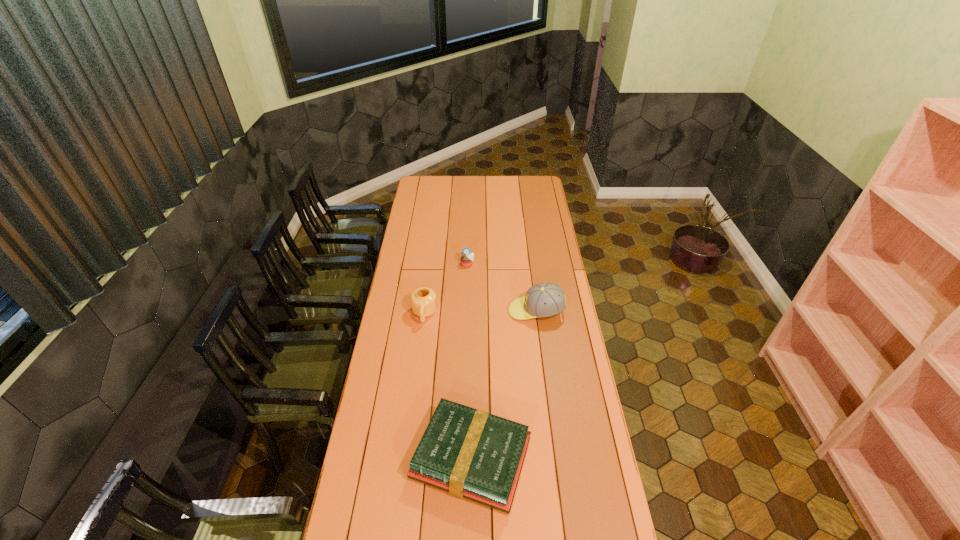
Locate an element on the screen. baseball cap is located at coordinates (542, 300).

The image size is (960, 540). Find the location of `mug`. mug is located at coordinates (423, 300).

This screenshot has width=960, height=540. In order to click on the farthest object in this screenshot , I will do `click(467, 258)`.

Locate an element on the screen. The height and width of the screenshot is (540, 960). hardback book is located at coordinates (469, 453).

In order to click on vacant area located on the front-facing side of the tallest object in this screenshot , I will do `click(449, 311)`.

Find the location of a particular element. vacant space located on the front-facing side of the tallest object is located at coordinates (445, 311).

Find the location of a particular element. The height and width of the screenshot is (540, 960). free region located 0.220m on the front-facing side of the tallest object is located at coordinates (461, 311).

The width and height of the screenshot is (960, 540). I want to click on free spot located on the handle side of the mug, so click(419, 359).

Where is `vacant area situated on the front-facing side of the farthest object`? vacant area situated on the front-facing side of the farthest object is located at coordinates (466, 327).

Where is `free space located 0.300m on the back of the nearest object`? free space located 0.300m on the back of the nearest object is located at coordinates (473, 347).